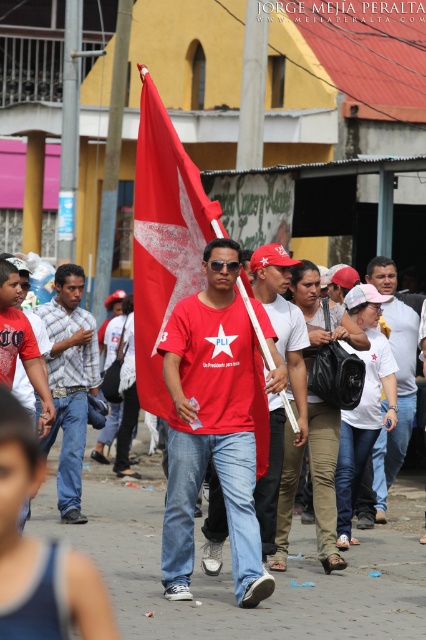
Is plaid shirt at center above white matte shirt at center?

No, plaid shirt at center is not above white matte shirt at center.

Which of these two, plaid shirt at center or white matte shirt at center, stands taller?

Standing taller between the two is white matte shirt at center.

The width and height of the screenshot is (426, 640). What do you see at coordinates (69, 381) in the screenshot?
I see `plaid shirt at center` at bounding box center [69, 381].

Where is `plaid shirt at center`? The image size is (426, 640). plaid shirt at center is located at coordinates (69, 381).

Does red fabric flag at center appear under matte red cap at center?

No.

Does point (141, 138) come farther from viewer compared to point (265, 273)?

Yes, point (141, 138) is farther from viewer.

Measure the distance between red fabric flag at center and camera.

red fabric flag at center is 10.65 meters from camera.

Where is `red fabric flag at center`? Image resolution: width=426 pixels, height=640 pixels. red fabric flag at center is located at coordinates (164, 237).

Does matte red cap at center appear under white matte shirt at center?

Correct, matte red cap at center is located below white matte shirt at center.

Find the location of a particular element. This screenshot has height=640, width=426. matte red cap at center is located at coordinates (282, 321).

This screenshot has height=640, width=426. What are the coordinates of `matte red cap at center` in the screenshot? It's located at (282, 321).